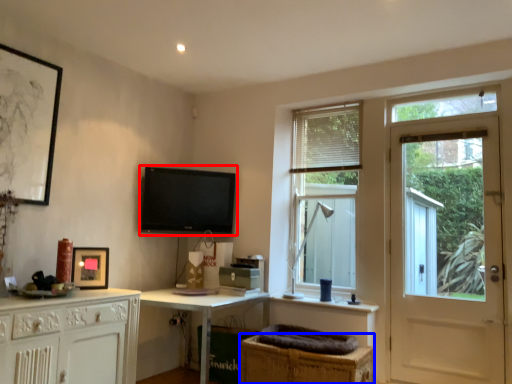
Question: Which point is further to the camera, television (highlighted by a red box) or cabinetry (highlighted by a blue box)?

Choices:
 (A) television
 (B) cabinetry

Answer: (A)